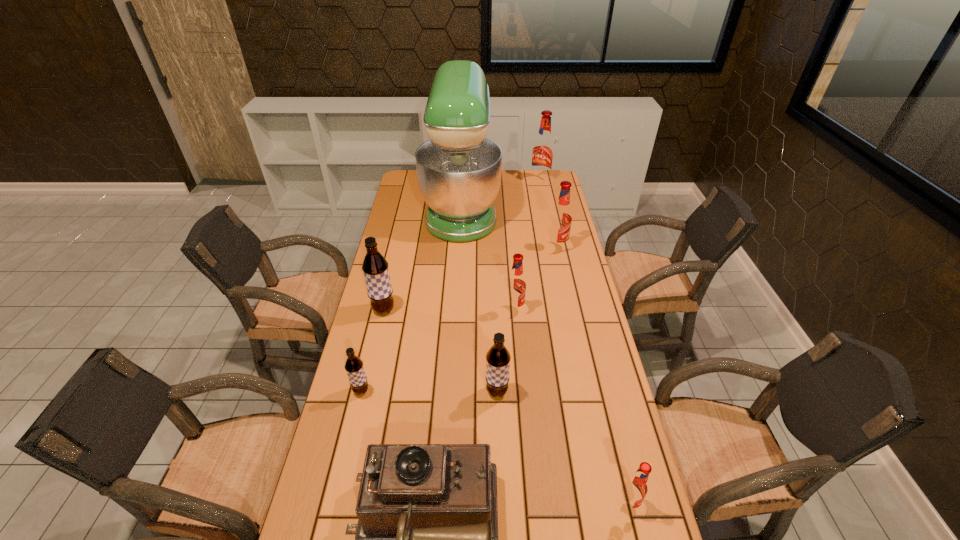
At what (x,y) coordinates should I click in order to perform the action: click on the second smallest brown root beer. Please return your answer as a coordinate pair (x, y). The height and width of the screenshot is (540, 960). Looking at the image, I should click on pos(498,358).

Identify the location of the nearest red root beer. The width and height of the screenshot is (960, 540). (635, 488).

Locate an element on the screen. The height and width of the screenshot is (540, 960). the smallest red root beer is located at coordinates (635, 488).

This screenshot has width=960, height=540. What are the coordinates of `the smallest brown root beer` in the screenshot? It's located at (354, 367).

What are the coordinates of `free spot located on the controls of the mixer` in the screenshot? It's located at (549, 207).

Locate an element on the screen. The image size is (960, 540). free region located on the back of the farthest red root beer is located at coordinates (538, 171).

Locate an element on the screen. The width and height of the screenshot is (960, 540). vacant area situated 0.250m on the back of the third nearest red root beer is located at coordinates (549, 210).

This screenshot has height=540, width=960. I want to click on blank area located on the back of the biggest brown root beer, so click(389, 286).

Identify the location of free region located on the left of the third biggest red root beer. The image size is (960, 540). (436, 310).

The width and height of the screenshot is (960, 540). Find the location of `free space located on the right of the rightmost brown root beer`. free space located on the right of the rightmost brown root beer is located at coordinates (529, 392).